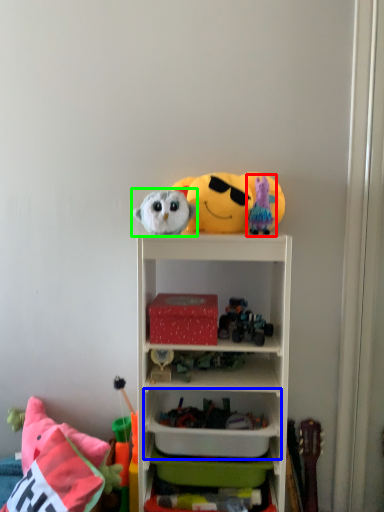
Question: Considering the real-world distances, which object is closest to toy (highlighted by a red box)? cabinet (highlighted by a blue box) or toy (highlighted by a green box).

Choices:
 (A) cabinet
 (B) toy

Answer: (B)